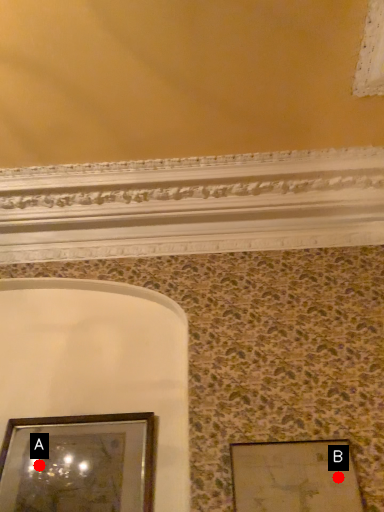
Question: Two points are circled on the image, labeled by A and B beside each circle. Which point is closer to the camera taking this photo?

Choices:
 (A) A is closer
 (B) B is closer

Answer: (B)